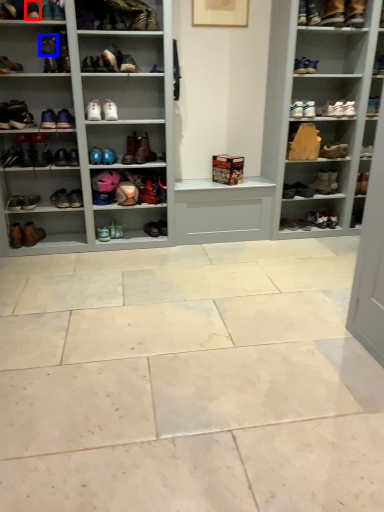
Question: Which point is closer to the camera, shoe (highlighted by a red box) or shoe (highlighted by a blue box)?

Choices:
 (A) shoe
 (B) shoe

Answer: (A)